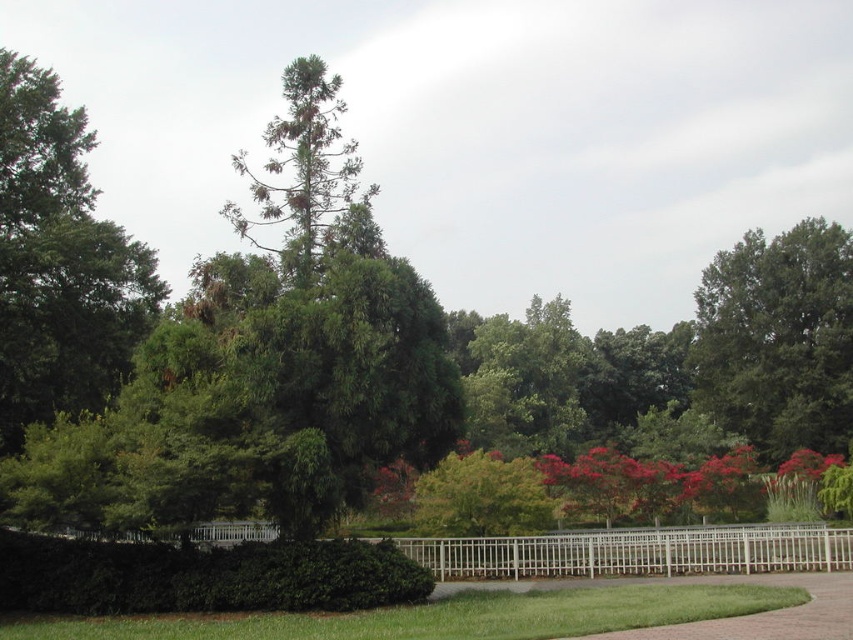
You are standing in the park and see the green leafy tree at upper right and the white wooden fence at center. Which object is located higher in the image?

The green leafy tree at upper right is positioned over the white wooden fence at center, so it is higher in the image.

You are standing in the park and want to take a photo of both point (x=107, y=353) and point (x=785, y=445) in the scene. Which point is closer to your camera lens?

Point (x=107, y=353) is closer to the camera than point (x=785, y=445).